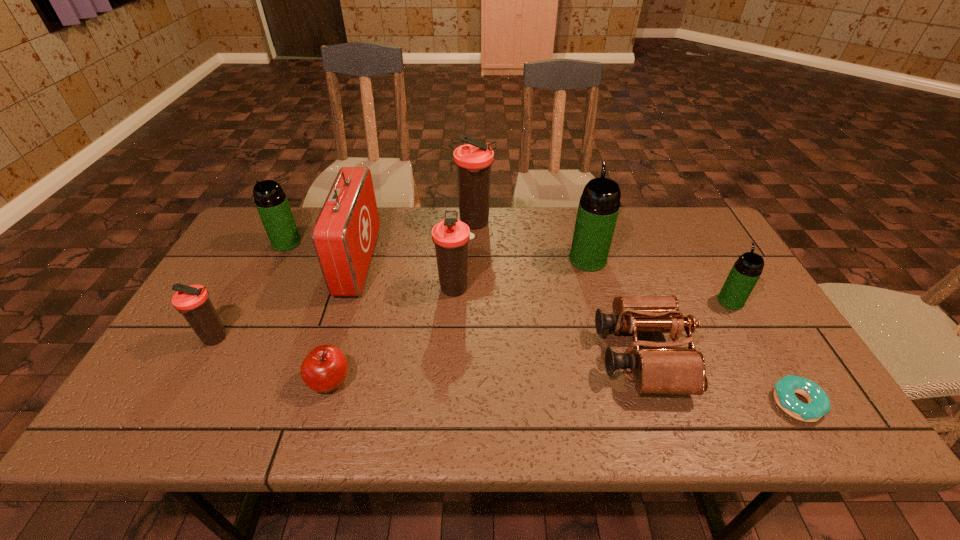
Where is `unoccupied position between the smallest green thermos bottle and the shortest object`? This screenshot has height=540, width=960. unoccupied position between the smallest green thermos bottle and the shortest object is located at coordinates 763,352.

The image size is (960, 540). What are the coordinates of `free area in between the first-aid kit and the binoculars` in the screenshot? It's located at pos(500,308).

The width and height of the screenshot is (960, 540). I want to click on free spot between the biggest green thermos bottle and the apple, so click(459, 320).

In order to click on free space between the second smallest green thermos bottle and the apple in this screenshot , I will do `click(308, 312)`.

Locate which object ranks fifth in proximity to the second biggest green thermos bottle. Please provide its 2D coordinates. Your answer should be formatted as a tuple, i.e. [(x, y)], where the tuple contains the x and y coordinates of a point satisfying the conditions above.

[(473, 161)]

The height and width of the screenshot is (540, 960). Identify the location of the eighth closest object to the nearest brown thermos bottle. (819, 404).

Identify which thermos bottle is the fourth nearest to the nearest thermos bottle. Please provide its 2D coordinates. Your answer should be formatted as a tuple, i.e. [(x, y)], where the tuple contains the x and y coordinates of a point satisfying the conditions above.

[(599, 205)]

Select which thermos bottle appears as the fifth closest to the biggest brown thermos bottle. Please provide its 2D coordinates. Your answer should be formatted as a tuple, i.e. [(x, y)], where the tuple contains the x and y coordinates of a point satisfying the conditions above.

[(193, 302)]

Locate an element on the screen. The width and height of the screenshot is (960, 540). brown thermos bottle that is the nearest to the leftmost green thermos bottle is located at coordinates (193, 302).

Locate an element on the screen. the closest brown thermos bottle to the third shortest object is located at coordinates (451, 236).